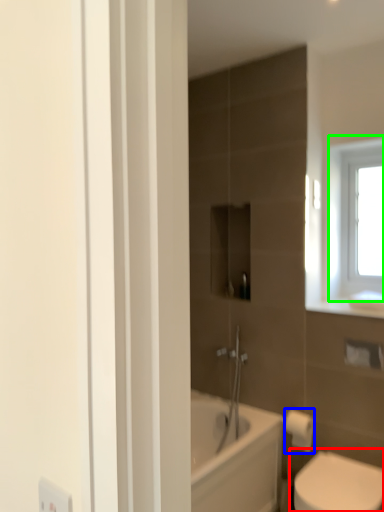
Question: Which object is positioned farthest from toilet (highlighted by a red box)? Select from toilet paper (highlighted by a blue box) and window (highlighted by a green box).

Choices:
 (A) toilet paper
 (B) window

Answer: (B)